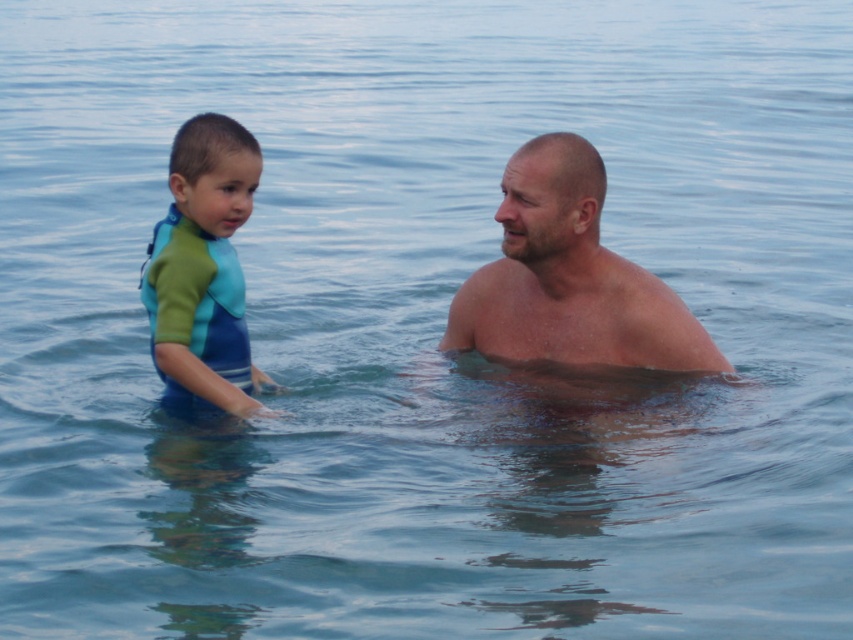
Who is positioned more to the left, smooth skin man at center or green-blue wetsuit at left?

Positioned to the left is green-blue wetsuit at left.

Which of these two, smooth skin man at center or green-blue wetsuit at left, stands shorter?

Standing shorter between the two is smooth skin man at center.

Is point (503, 273) farther from camera compared to point (212, 260)?

Yes, point (503, 273) is behind point (212, 260).

You are a GUI agent. You are given a task and a screenshot of the screen. Output one action in this format:
    pyautogui.click(x=<x>, y=<y>)
    Task: Click on the smooth skin man at center
    The image size is (853, 640).
    Given the screenshot: What is the action you would take?
    pyautogui.click(x=570, y=278)